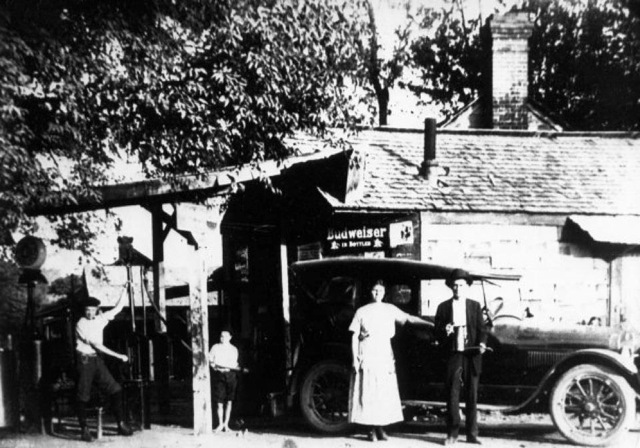
Where is `hood`? This screenshot has height=448, width=640. hood is located at coordinates (541, 326).